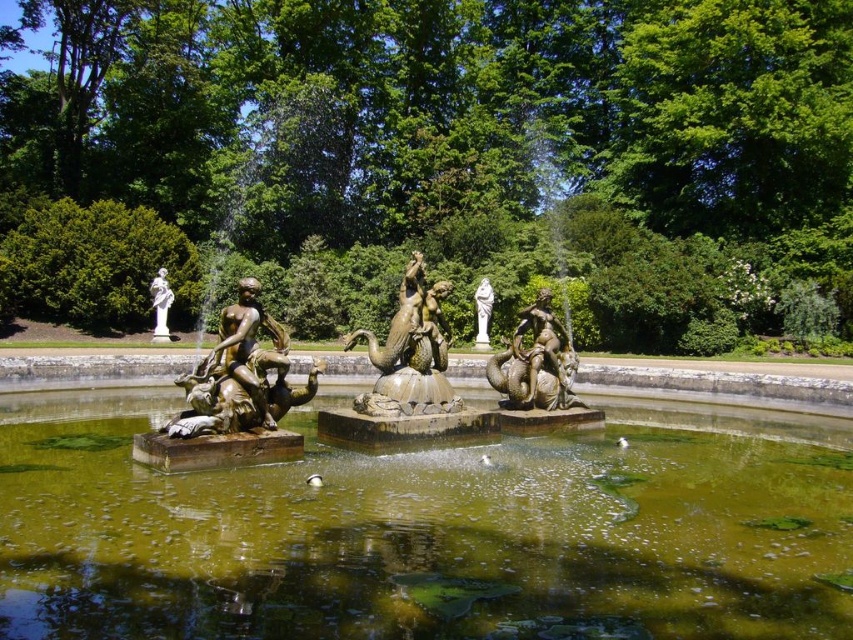
Question: Estimate the real-world distances between objects in this image. Which object is closer to the white marble statue at center?

Choices:
 (A) gold-bronze statue at center-left
 (B) bronze/golden statue at center
 (C) gold-bronze mermaid at center
 (D) white marble statue at upper left

Answer: (C)

Question: Considering the relative positions of green mossy water at center and white marble statue at center in the image provided, where is green mossy water at center located with respect to white marble statue at center?

Choices:
 (A) right
 (B) left

Answer: (B)

Question: Is bronze statue at center positioned in front of gold-bronze mermaid at center?

Choices:
 (A) no
 (B) yes

Answer: (B)

Question: Which object is positioned closest to the green mossy water at center?

Choices:
 (A) gold-bronze statue at center-left
 (B) white marble statue at upper left

Answer: (A)

Question: Where is bronze/golden statue at center located in relation to gold-bronze mermaid at center in the image?

Choices:
 (A) left
 (B) right

Answer: (A)

Question: Based on their relative distances, which object is farther from the gold-bronze statue at center-left?

Choices:
 (A) bronze/golden statue at center
 (B) white marble statue at upper left

Answer: (B)